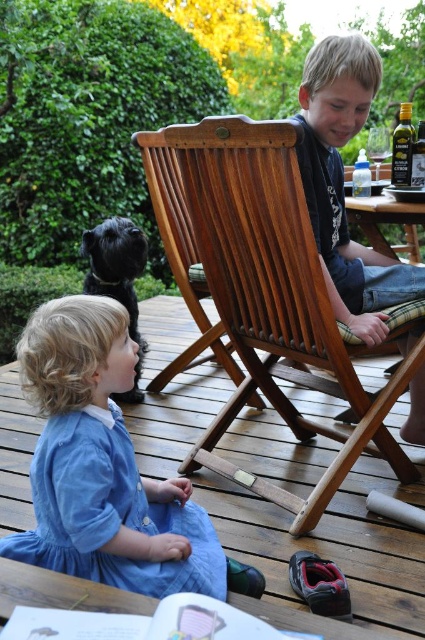
The height and width of the screenshot is (640, 425). What do you see at coordinates (105, 468) in the screenshot?
I see `blue denim dress at lower left` at bounding box center [105, 468].

Between point (110, 584) and point (351, 317), which one is positioned in front?

Positioned in front is point (110, 584).

Which is in front, point (70, 365) or point (320, 92)?

Positioned in front is point (70, 365).

The image size is (425, 640). In order to click on blue denim dress at lower left in this screenshot , I will do `click(105, 468)`.

Is smooth wooden chair at center above black shiny dog at left?

Yes.

Who is shorter, smooth wooden chair at center or black shiny dog at left?

black shiny dog at left is shorter.

Locate an element on the screen. smooth wooden chair at center is located at coordinates click(x=342, y=184).

The height and width of the screenshot is (640, 425). I want to click on smooth wooden chair at center, so click(x=342, y=184).

Measure the distance between wooden chair at center and wooden picnic table at center.

They are 28.90 inches apart.

Does wooden chair at center lie in front of wooden picnic table at center?

That is True.

The width and height of the screenshot is (425, 640). What do you see at coordinates (261, 292) in the screenshot?
I see `wooden chair at center` at bounding box center [261, 292].

Identify the location of wooden chair at center. The height and width of the screenshot is (640, 425). (261, 292).